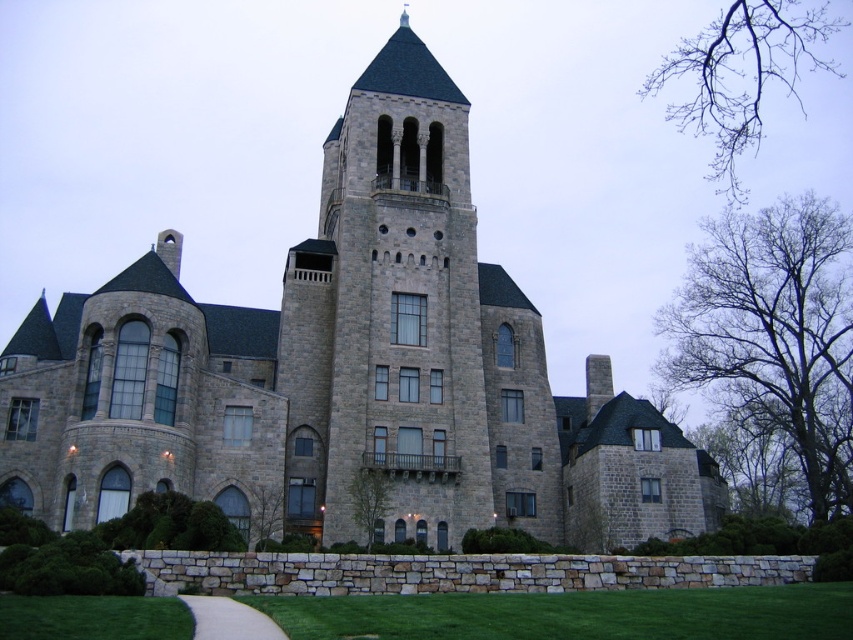
Based on the coordinates provided, which object is located at point (345, 372) in the image?

The point (345, 372) indicates the gray stone castle at center.

You are a visitor approaching the grand stone building and want to reach the entrance located at the base of the gray stone tower at center. The white gravel path at lower center is the only clear path available. Considering the height of the tower, do you think the path will lead you directly to the entrance of the tower?

The gray stone tower at center is much taller than the white gravel path at lower center, but the path is still the direct route to the tower entrance. The height of the tower doesn not affect the path leading to its base, so yes, the white gravel path at lower center will lead you directly to the entrance.